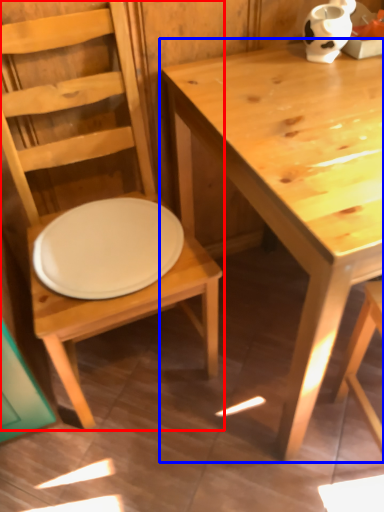
Question: Among these objects, which one is farthest to the camera, chair (highlighted by a red box) or table (highlighted by a blue box)?

Choices:
 (A) chair
 (B) table

Answer: (B)